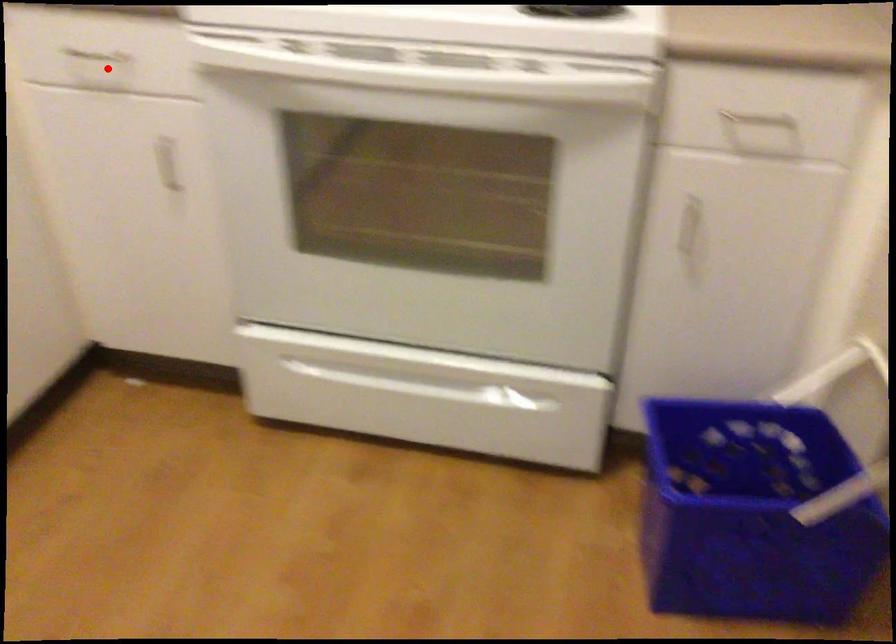
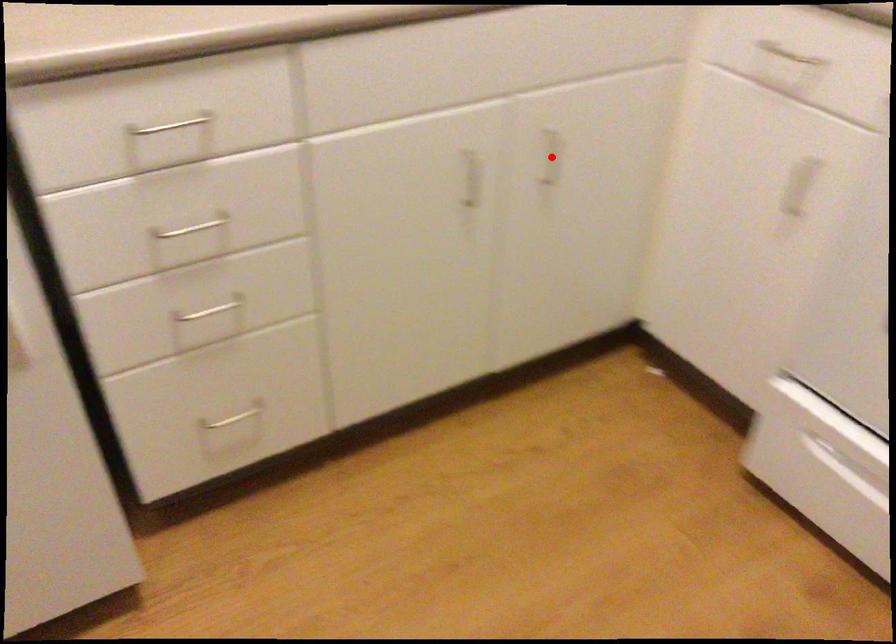
I am providing you with two images of the same scene from different viewpoints. A red point is marked on the first image and another point is marked on the second image. Does the point marked in image1 correspond to the same location as the one in image2?

No